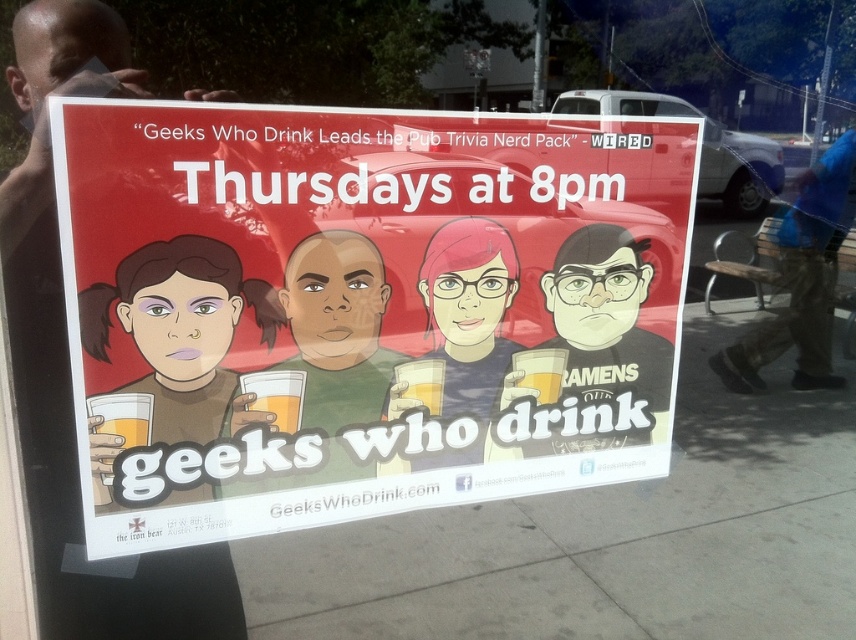
Which is above, blue fabric bag at right or translucent glass mug at center?

blue fabric bag at right

Is point (840, 237) closer to camera compared to point (247, 385)?

No.

You are a GUI agent. You are given a task and a screenshot of the screen. Output one action in this format:
    pyautogui.click(x=<x>, y=<y>)
    Task: Click on the blue fabric bag at right
    Image resolution: width=856 pixels, height=640 pixels.
    Given the screenshot: What is the action you would take?
    pyautogui.click(x=800, y=282)

Locate an element on the screen. The width and height of the screenshot is (856, 640). blue fabric bag at right is located at coordinates [800, 282].

Can you confirm if green matte shirt at center is shorter than blue fabric bag at right?

Yes.

Is point (373, 371) less distant than point (851, 150)?

Yes, it is in front of point (851, 150).

What do you see at coordinates (333, 348) in the screenshot? The width and height of the screenshot is (856, 640). I see `green matte shirt at center` at bounding box center [333, 348].

At what (x,y) coordinates should I click in order to perform the action: click on green matte shirt at center. Please return your answer as a coordinate pair (x, y). The width and height of the screenshot is (856, 640). Looking at the image, I should click on (333, 348).

Can you confirm if matte paper poster at center is shorter than blue fabric bag at right?

Yes, matte paper poster at center is shorter than blue fabric bag at right.

Does matte paper poster at center have a greater height compared to blue fabric bag at right?

No, matte paper poster at center is not taller than blue fabric bag at right.

The image size is (856, 640). What are the coordinates of `matte paper poster at center` in the screenshot? It's located at (364, 305).

Where is `matte paper poster at center`? The height and width of the screenshot is (640, 856). matte paper poster at center is located at coordinates (364, 305).